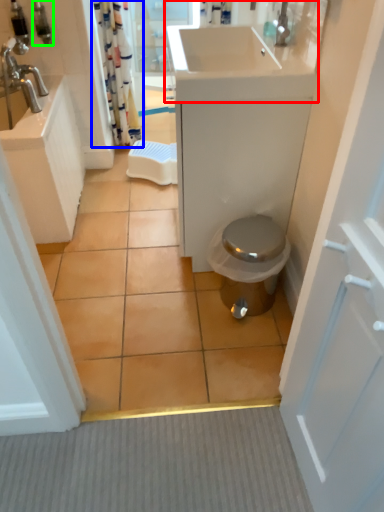
Question: Estimate the real-world distances between objects in this image. Which object is farther from sink (highlighted by a red box), shower curtain (highlighted by a blue box) or toiletry (highlighted by a green box)?

Choices:
 (A) shower curtain
 (B) toiletry

Answer: (B)